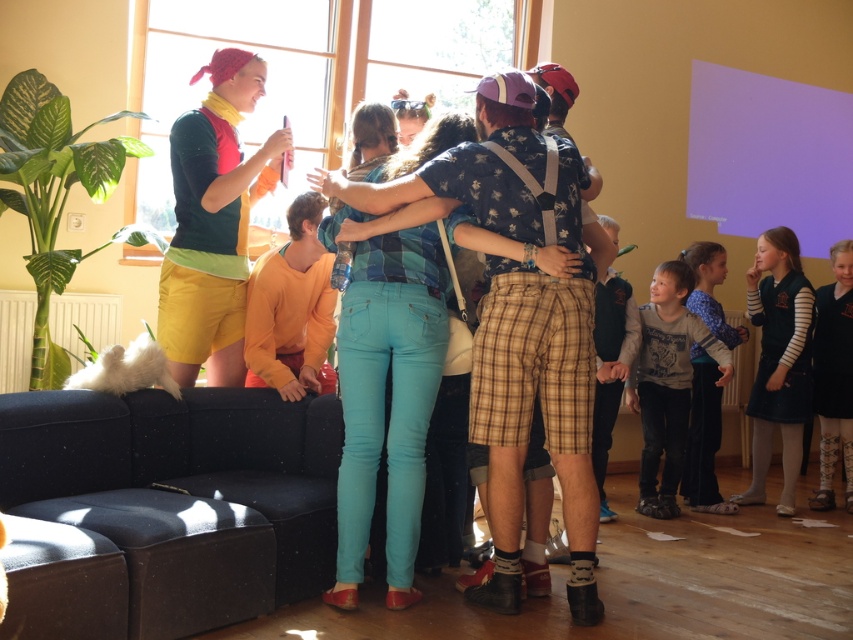
You are a photographer standing in the scene. You want to take a photo that includes both the dark blue dress at right and the gray cotton shirt at lower right. What is the minimum distance you need to move backward to ensure both are fully visible in the frame?

The minimum distance you need to move backward is 26.85 inches to ensure both the dark blue dress at right and the gray cotton shirt at lower right are fully visible in the frame.

You are standing at the entrance of the room and want to find the dark blue fabric couch at lower left. According to the coordinates provided, in which direction should you look to locate it?

The dark blue fabric couch at lower left is located at coordinates point (183, 492), which is in the lower left direction from your current position at the entrance.

You are a photographer standing in the room and want to take a photo that includes both the dark blue fabric couch at lower left and the dark blue dress at right. Given that your camera has a maximum zoom of 100mm, can you fit both objects into the frame without moving closer or farther away?

The dark blue fabric couch at lower left and dark blue dress at right are 3.76 meters apart. With a 100mm lens, the photographer can likely capture both objects in the frame as 3.76 meters is within the field of view of a 100mm lens at typical shooting distances, but it may require careful composition to ensure both are visible.